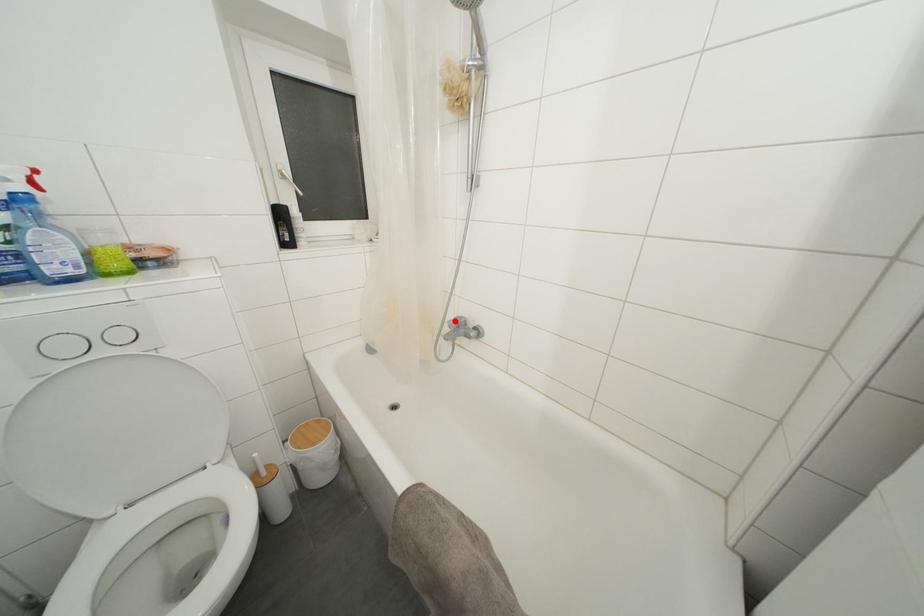
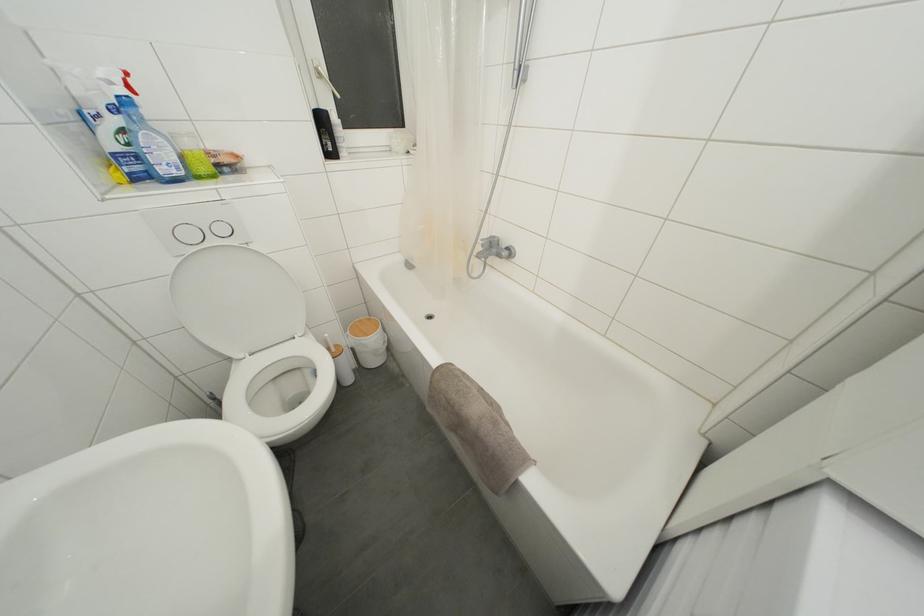
Question: I am providing you with two images of the same scene from different viewpoints. A red point is shown in image1. For the corresponding object point in image2, is it positioned nearer or farther from the camera?

Choices:
 (A) Nearer
 (B) Farther

Answer: (A)